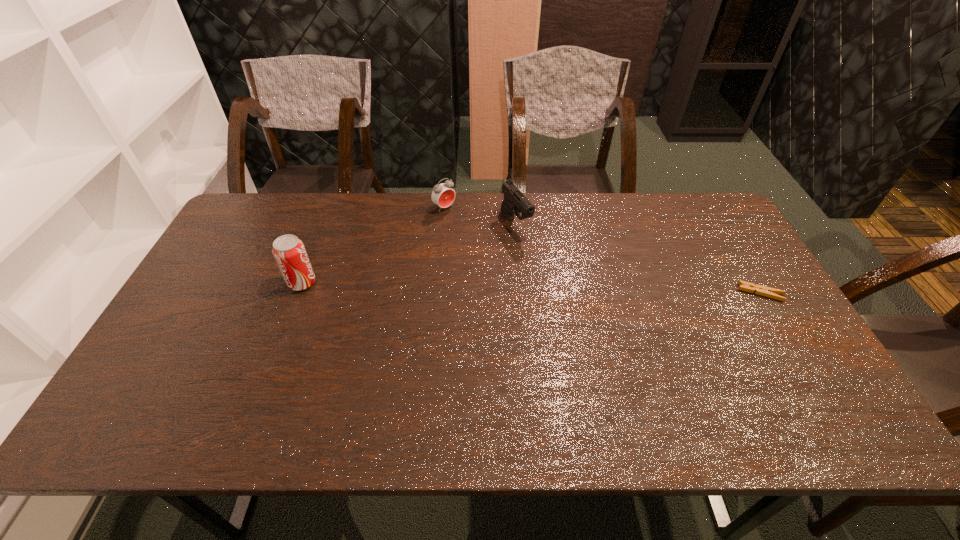
At what (x,y) coordinates should I click in order to perform the action: click on the leftmost object. Please return your answer as a coordinate pair (x, y). The image size is (960, 540). Looking at the image, I should click on (289, 252).

Where is `the shortest object`? This screenshot has width=960, height=540. the shortest object is located at coordinates (761, 290).

At what (x,y) coordinates should I click in order to perform the action: click on the rightmost object. Please return your answer as a coordinate pair (x, y). Looking at the image, I should click on (761, 290).

Where is `the second object from right to left`? The height and width of the screenshot is (540, 960). the second object from right to left is located at coordinates (514, 201).

Where is `alarm clock`? This screenshot has width=960, height=540. alarm clock is located at coordinates (443, 195).

At what (x,y) coordinates should I click in order to perform the action: click on free space located 0.270m on the logo side of the leftmost object. Please return your answer as a coordinate pair (x, y). The image size is (960, 540). Looking at the image, I should click on (409, 282).

This screenshot has width=960, height=540. In order to click on free space located on the back of the clothespin in this screenshot , I will do `click(745, 267)`.

What are the coordinates of `vacant space located 0.250m at the barrel of the pistol` in the screenshot? It's located at (565, 292).

The height and width of the screenshot is (540, 960). What are the coordinates of `vacant region located 0.200m at the barrel of the pistol` in the screenshot? It's located at (556, 280).

Where is `vacant space located at the barrel of the pistol`? vacant space located at the barrel of the pistol is located at coordinates (594, 327).